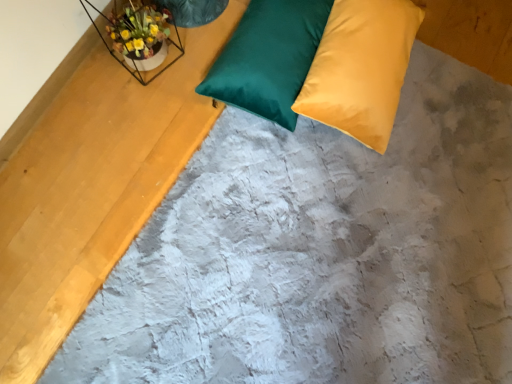
Question: Is matte yellow pillow at upper right, the second pillow positioned from the left, oriented away from metallic wire frame at upper left?

Choices:
 (A) yes
 (B) no

Answer: (A)

Question: Is metallic wire frame at upper left inside matte yellow pillow at upper right, the second pillow positioned from the left?

Choices:
 (A) yes
 (B) no

Answer: (B)

Question: Is matte yellow pillow at upper right, the second pillow positioned from the left, touching metallic wire frame at upper left?

Choices:
 (A) yes
 (B) no

Answer: (B)

Question: Is matte yellow pillow at upper right, the second pillow positioned from the left, to the right of metallic wire frame at upper left from the viewer's perspective?

Choices:
 (A) no
 (B) yes

Answer: (B)

Question: Can you confirm if matte yellow pillow at upper right, the 1th pillow in the right-to-left sequence, is smaller than metallic wire frame at upper left?

Choices:
 (A) yes
 (B) no

Answer: (B)

Question: In the image, is satin green pillow at upper center, arranged as the 1th pillow when viewed from the left, positioned in front of or behind metallic wire frame at upper left?

Choices:
 (A) behind
 (B) front

Answer: (A)

Question: From a real-world perspective, relative to metallic wire frame at upper left, is satin green pillow at upper center, arranged as the 1th pillow when viewed from the left, vertically above or below?

Choices:
 (A) above
 (B) below

Answer: (B)

Question: From the image's perspective, relative to metallic wire frame at upper left, is satin green pillow at upper center, positioned as the 2th pillow in right-to-left order, above or below?

Choices:
 (A) above
 (B) below

Answer: (B)

Question: In the image, is satin green pillow at upper center, positioned as the 2th pillow in right-to-left order, on the left side or the right side of metallic wire frame at upper left?

Choices:
 (A) right
 (B) left

Answer: (A)

Question: From the image's perspective, is metallic wire frame at upper left positioned above or below satin green pillow at upper center, positioned as the 2th pillow in right-to-left order?

Choices:
 (A) below
 (B) above

Answer: (B)

Question: Is point (154, 77) closer or farther from the camera than point (317, 36)?

Choices:
 (A) closer
 (B) farther

Answer: (B)

Question: Looking at their shapes, would you say metallic wire frame at upper left is wider or thinner than satin green pillow at upper center, positioned as the 2th pillow in right-to-left order?

Choices:
 (A) thin
 (B) wide

Answer: (A)

Question: Which is correct: metallic wire frame at upper left is inside satin green pillow at upper center, arranged as the 1th pillow when viewed from the left, or outside of it?

Choices:
 (A) outside
 (B) inside

Answer: (A)

Question: From a real-world perspective, is matte yellow pillow at upper right, the second pillow positioned from the left, positioned above or below satin green pillow at upper center, arranged as the 1th pillow when viewed from the left?

Choices:
 (A) below
 (B) above

Answer: (B)

Question: Based on their sizes in the image, would you say matte yellow pillow at upper right, the 1th pillow in the right-to-left sequence, is bigger or smaller than satin green pillow at upper center, positioned as the 2th pillow in right-to-left order?

Choices:
 (A) big
 (B) small

Answer: (A)